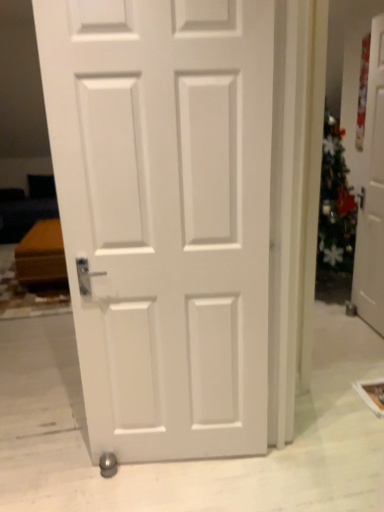
What do you see at coordinates (372, 194) in the screenshot?
I see `white matte door at right` at bounding box center [372, 194].

The height and width of the screenshot is (512, 384). In order to click on white matte door at right in this screenshot , I will do `click(372, 194)`.

Locate an element on the screen. Image resolution: width=384 pixels, height=512 pixels. white matte door at right is located at coordinates (372, 194).